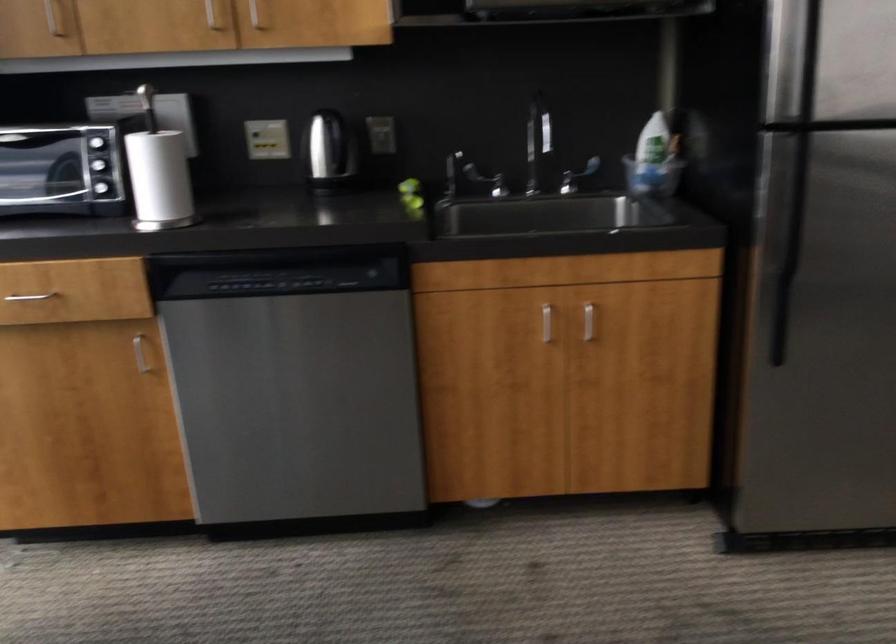
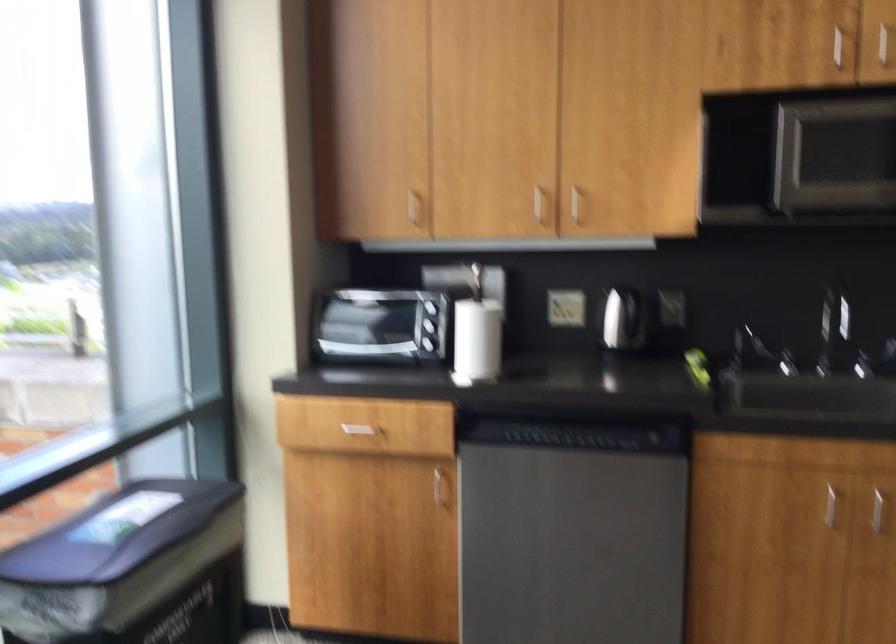
Question: The camera is either moving clockwise (left) or counter-clockwise (right) around the object. The first image is from the beginning of the video and the second image is from the end. Is the camera moving left or right when shooting the video?

Choices:
 (A) Left
 (B) Right

Answer: (B)